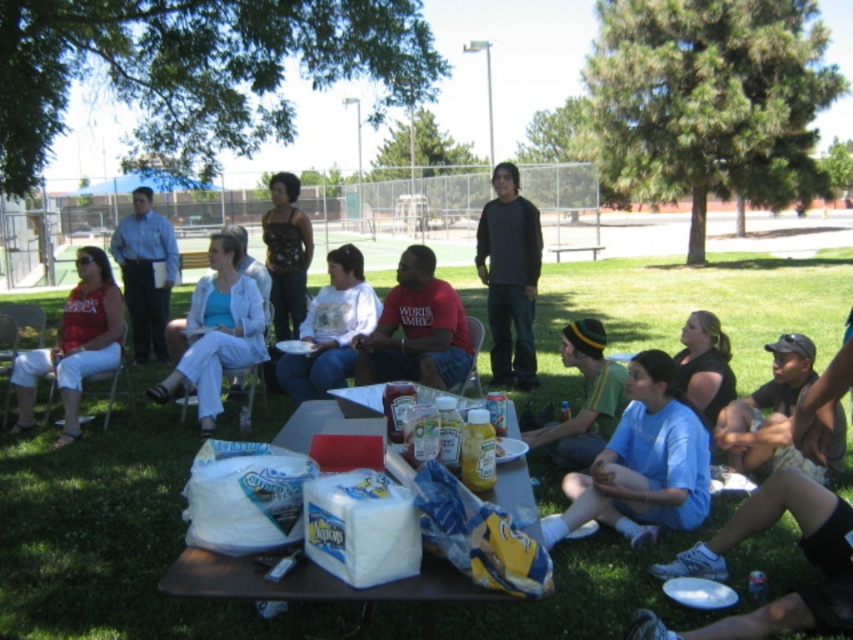
Question: Considering the relative positions of light blue fabric shirt at center and green knit cap at center in the image provided, where is light blue fabric shirt at center located with respect to green knit cap at center?

Choices:
 (A) below
 (B) above

Answer: (B)

Question: Does light blue fabric shirt at lower center appear over dark gray long-sleeve shirt at center?

Choices:
 (A) yes
 (B) no

Answer: (B)

Question: From the image, what is the correct spatial relationship of green grass at center in relation to white cotton shirt at center?

Choices:
 (A) above
 (B) below

Answer: (A)

Question: Which object is positioned farthest from the black textured tank top at center?

Choices:
 (A) dark gray long-sleeve shirt at center
 (B) light blue fabric shirt at lower center

Answer: (B)

Question: Which object appears farthest from the camera in this image?

Choices:
 (A) black cotton shirt at lower right
 (B) green knit cap at center

Answer: (B)

Question: Considering the real-world distances, which object is closest to the green grass at center?

Choices:
 (A) camouflage-patterned shorts at lower right
 (B) matte red shirt at center

Answer: (A)